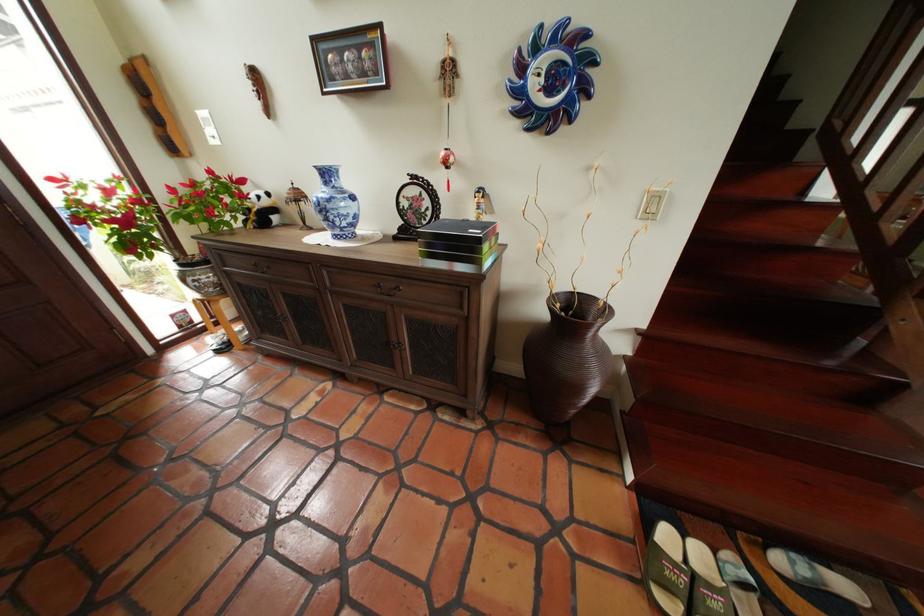
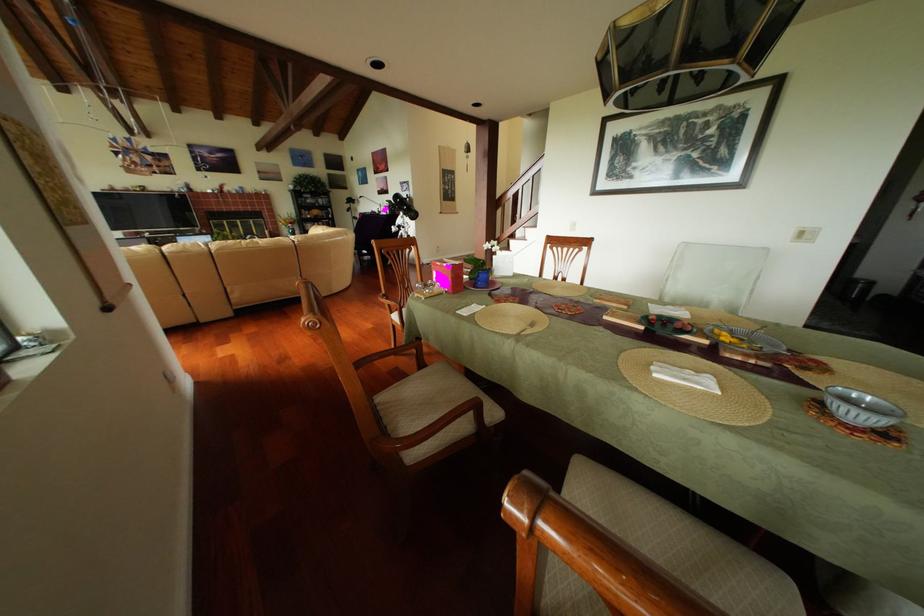
Question: I am providing you with two images of the same scene from different viewpoints. After the viewpoint changes to image2, which objects are now occluded?

Choices:
 (A) chair sitting surface
 (B) round decorative frame
 (C) vacuum cleaner wand
 (D) pink gift box

Answer: (B)